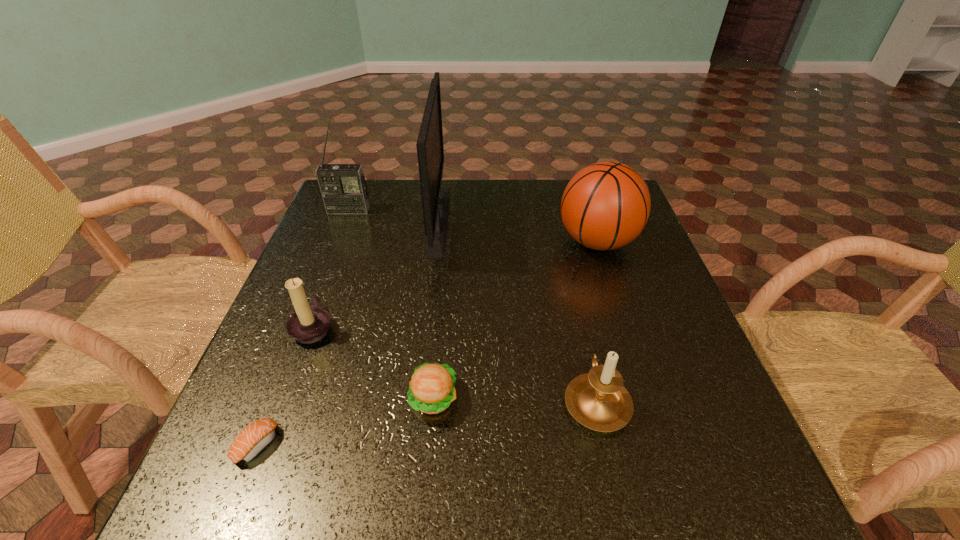
Where is `free spot between the nearer candle holder and the sixth tallest object`? The height and width of the screenshot is (540, 960). free spot between the nearer candle holder and the sixth tallest object is located at coordinates (515, 399).

The image size is (960, 540). I want to click on object that is the fourth closest one to the basketball, so click(x=344, y=191).

Find the location of a particular element. This screenshot has height=540, width=960. object that is the sixth nearest to the monitor is located at coordinates (256, 436).

Locate an element on the screen. Image resolution: width=960 pixels, height=540 pixels. free space in the image that satisfies the following two spatial constraints: 1. on the front-facing side of the fifth shortest object; 2. on the left side of the tallest object is located at coordinates (436, 242).

You are a GUI agent. You are given a task and a screenshot of the screen. Output one action in this format:
    pyautogui.click(x=<x>, y=<y>)
    Task: Click on the blank area in the image that satisfies the following two spatial constraints: 1. on the wick of the fourth farthest object; 2. with a handle on the side of the right candle holder
    
    Given the screenshot: What is the action you would take?
    pyautogui.click(x=286, y=400)

Find the location of a particular element. This screenshot has height=540, width=960. free space that satisfies the following two spatial constraints: 1. with a handle on the side of the basketball; 2. on the left side of the right candle holder is located at coordinates (561, 242).

You are a GUI agent. You are given a task and a screenshot of the screen. Output one action in this format:
    pyautogui.click(x=<x>, y=<y>)
    Task: Click on the vacant space that satisfies the following two spatial constraints: 1. with a handle on the side of the basketball; 2. on the left side of the right candle holder
    This screenshot has width=960, height=540.
    Given the screenshot: What is the action you would take?
    pyautogui.click(x=561, y=242)